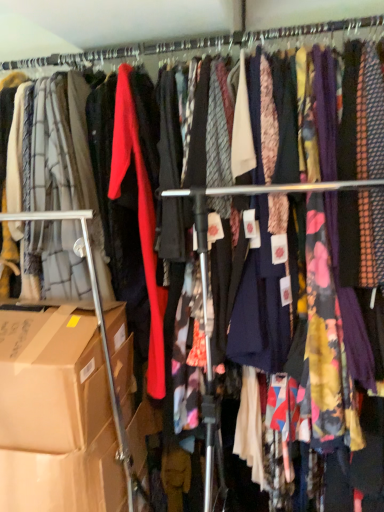
This screenshot has height=512, width=384. Identify the location of brown cardboard box at lower left. (51, 380).

Image resolution: width=384 pixels, height=512 pixels. What do you see at coordinates (51, 380) in the screenshot? I see `brown cardboard box at lower left` at bounding box center [51, 380].

Image resolution: width=384 pixels, height=512 pixels. What are the coordinates of `brown cardboard box at lower left` in the screenshot? It's located at (51, 380).